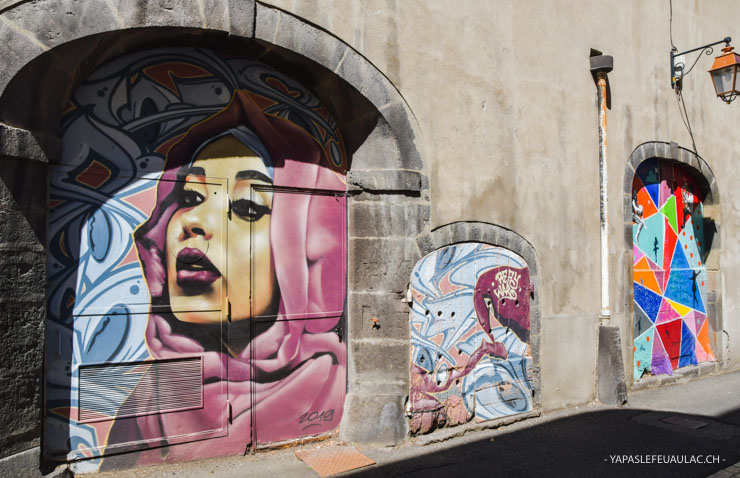
Identify the location of art. The height and width of the screenshot is (478, 740). (223, 174), (462, 304), (676, 263).